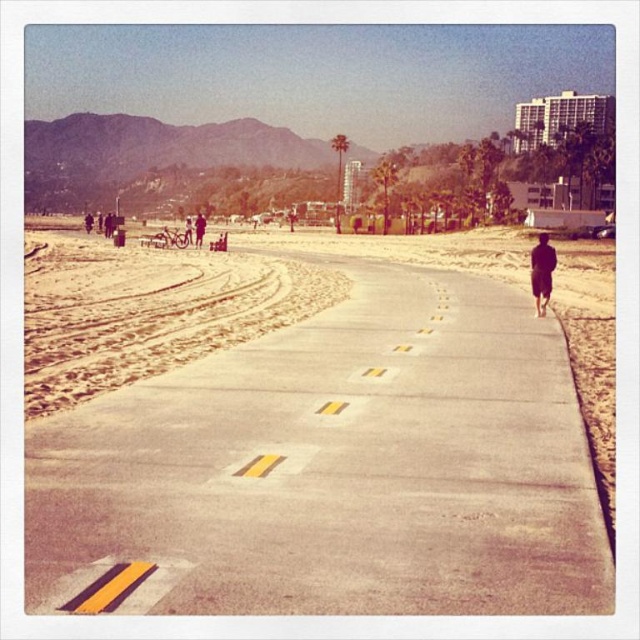
Question: Can you confirm if concrete at center is smaller than dark blue fabric at center?

Choices:
 (A) no
 (B) yes

Answer: (B)

Question: Is concrete at center smaller than black matte jacket at right?

Choices:
 (A) yes
 (B) no

Answer: (A)

Question: Which of the following is the farthest from the observer?

Choices:
 (A) (548, 253)
 (B) (228, 320)

Answer: (A)

Question: Which of the following is the farthest from the observer?

Choices:
 (A) dark blue fabric at center
 (B) concrete at center
 (C) sandy yellow at left
 (D) black matte jacket at right

Answer: (A)

Question: Can you confirm if concrete at center is positioned above dark blue fabric at center?

Choices:
 (A) yes
 (B) no

Answer: (B)

Question: Which point is closer to the camera?

Choices:
 (A) black matte jacket at right
 (B) dark blue fabric at center
 (C) concrete at center

Answer: (C)